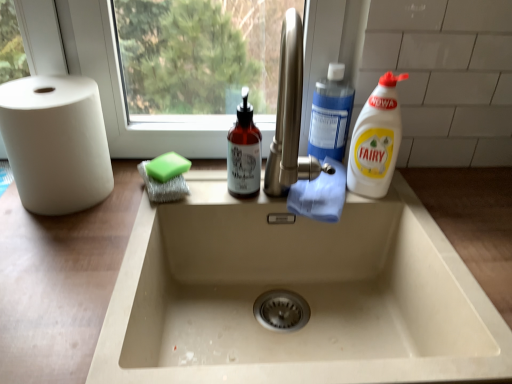
Locate an element on the screen. This screenshot has width=512, height=384. vacant area to the right of white matte paper towel at left is located at coordinates (148, 204).